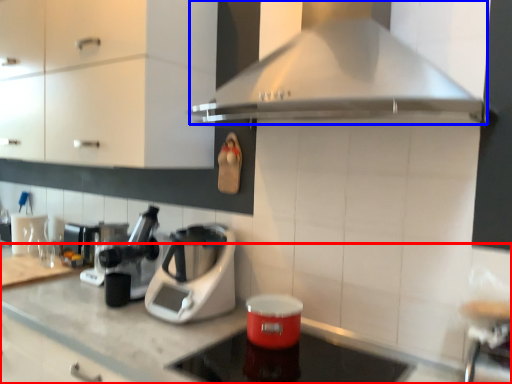
Question: Which point is closer to the camera, countertop (highlighted by a red box) or home appliance (highlighted by a blue box)?

Choices:
 (A) countertop
 (B) home appliance

Answer: (A)